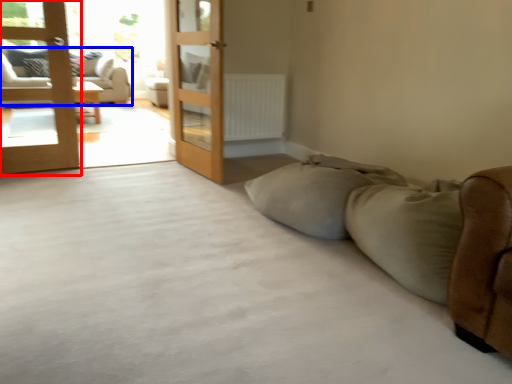
Question: Which point is further to the camera, door (highlighted by a red box) or studio couch (highlighted by a blue box)?

Choices:
 (A) door
 (B) studio couch

Answer: (B)